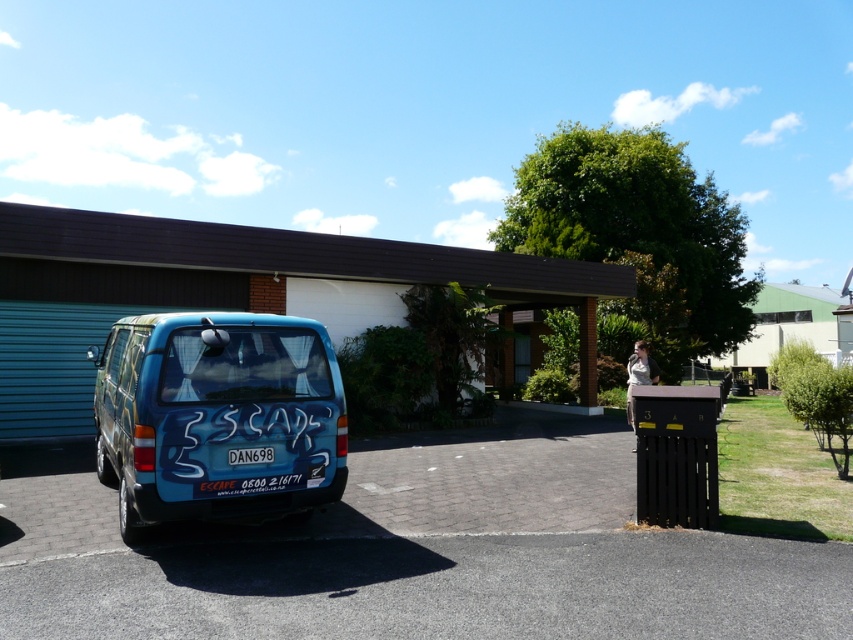
You are standing in front of the blue van and looking at the scene. Which object is positioned to the right of the other between the black asphalt at lower center and the white plastic license plate at center?

The black asphalt at lower center is to the right of the white plastic license plate at center according to the description.

From the picture: You are standing in front of the van and want to walk to the point labeled as point (190, 328). Which direction should you walk relative to the point (236, 452)?

You should walk towards the direction behind point (236, 452) to reach point (190, 328) because point (190, 328) is located behind point (236, 452) according to the spatial description.